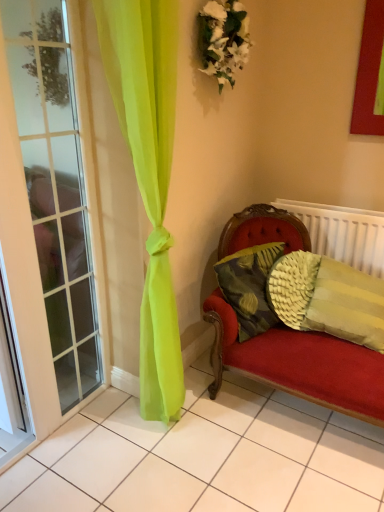
This screenshot has width=384, height=512. I want to click on white textured radiator at right, so click(342, 233).

Image resolution: width=384 pixels, height=512 pixels. Describe the element at coordinates (223, 39) in the screenshot. I see `white fabric floral arrangement at upper center` at that location.

The height and width of the screenshot is (512, 384). What do you see at coordinates (327, 298) in the screenshot? I see `textured yellow pillow at right, which ranks as the 2th pillow in left-to-right order` at bounding box center [327, 298].

Find the location of `textured yellow pillow at right, the first pillow from the left`. textured yellow pillow at right, the first pillow from the left is located at coordinates (249, 287).

Which pillow is the 1st one when counting from the front of the white textured radiator at right? Please provide its 2D coordinates.

[(249, 287)]

Which is more to the right, white textured radiator at right or textured yellow pillow at right, which is the second pillow from right to left?

white textured radiator at right.

Is white textured radiator at right facing towards textured yellow pillow at right, the first pillow from the left?

Yes, white textured radiator at right is oriented towards textured yellow pillow at right, the first pillow from the left.

Is the surface of white textured radiator at right in direct contact with clear glass door at left?

white textured radiator at right and clear glass door at left are not in contact.

Can you confirm if white textured radiator at right is thinner than clear glass door at left?

No, white textured radiator at right is not thinner than clear glass door at left.

Considering the sizes of objects white textured radiator at right and clear glass door at left in the image provided, who is smaller, white textured radiator at right or clear glass door at left?

white textured radiator at right.

Which is more to the right, white textured radiator at right or clear glass door at left?

white textured radiator at right is more to the right.

Considering the relative sizes of white fabric floral arrangement at upper center and textured yellow pillow at right, which ranks as the 2th pillow in left-to-right order, in the image provided, is white fabric floral arrangement at upper center wider than textured yellow pillow at right, which ranks as the 2th pillow in left-to-right order,?

In fact, white fabric floral arrangement at upper center might be narrower than textured yellow pillow at right, which ranks as the 2th pillow in left-to-right order.

From a real-world perspective, who is located lower, white fabric floral arrangement at upper center or textured yellow pillow at right, positioned as the first pillow in right-to-left order?

In real-world perspective, textured yellow pillow at right, positioned as the first pillow in right-to-left order, is lower.

Which object is positioned more to the right, white fabric floral arrangement at upper center or textured yellow pillow at right, which ranks as the 2th pillow in left-to-right order?

textured yellow pillow at right, which ranks as the 2th pillow in left-to-right order.

Measure the distance between white fabric floral arrangement at upper center and white textured radiator at right.

They are 1.01 meters apart.

Where is `floral arrangement in front of the white textured radiator at right`? This screenshot has width=384, height=512. floral arrangement in front of the white textured radiator at right is located at coordinates (223, 39).

Does point (213, 70) come farther from viewer compared to point (324, 218)?

No.

From the image's perspective, is white fabric floral arrangement at upper center above or below white textured radiator at right?

Based on their image positions, white fabric floral arrangement at upper center is located above white textured radiator at right.

From a real-world perspective, is textured yellow pillow at right, which ranks as the 2th pillow in left-to-right order, over white fabric floral arrangement at upper center?

No, from a real-world perspective, textured yellow pillow at right, which ranks as the 2th pillow in left-to-right order, is not above white fabric floral arrangement at upper center.

How many degrees apart are the facing directions of textured yellow pillow at right, positioned as the first pillow in right-to-left order, and white fabric floral arrangement at upper center?

There is a 94.2-degree angle between the facing directions of textured yellow pillow at right, positioned as the first pillow in right-to-left order, and white fabric floral arrangement at upper center.

Which is closer to the camera, (342, 337) or (248, 23)?

Positioned in front is point (342, 337).

Considering the sizes of objects textured yellow pillow at right, which ranks as the 2th pillow in left-to-right order, and white fabric floral arrangement at upper center in the image provided, who is wider, textured yellow pillow at right, which ranks as the 2th pillow in left-to-right order, or white fabric floral arrangement at upper center?

textured yellow pillow at right, which ranks as the 2th pillow in left-to-right order.

Is white textured radiator at right inside the boundaries of white fabric floral arrangement at upper center, or outside?

white textured radiator at right is not enclosed by white fabric floral arrangement at upper center.

From a real-world perspective, which object rests below the other?

From a 3D spatial view, white textured radiator at right is below.

Does white textured radiator at right turn towards white fabric floral arrangement at upper center?

No, white textured radiator at right does not turn towards white fabric floral arrangement at upper center.

Which is closer to the camera, (370, 340) or (257, 309)?

Point (370, 340) appears to be closer to the viewer than point (257, 309).

Does textured yellow pillow at right, which ranks as the 2th pillow in left-to-right order, come behind textured yellow pillow at right, which is the second pillow from right to left?

No, textured yellow pillow at right, which ranks as the 2th pillow in left-to-right order, is closer to the camera.

Looking at their sizes, would you say textured yellow pillow at right, which ranks as the 2th pillow in left-to-right order, is wider or thinner than textured yellow pillow at right, which is the second pillow from right to left?

In the image, textured yellow pillow at right, which ranks as the 2th pillow in left-to-right order, appears to be wider than textured yellow pillow at right, which is the second pillow from right to left.

From a real-world perspective, is textured yellow pillow at right, positioned as the first pillow in right-to-left order, over textured yellow pillow at right, which is the second pillow from right to left?

No, from a real-world perspective, textured yellow pillow at right, positioned as the first pillow in right-to-left order, is not over textured yellow pillow at right, which is the second pillow from right to left

Locate an element on the screen. The height and width of the screenshot is (512, 384). radiator above the textured yellow pillow at right, the first pillow from the left (from a real-world perspective) is located at coordinates (342, 233).

This screenshot has width=384, height=512. What are the coordinates of `window in front of the white textured radiator at right` in the screenshot? It's located at (51, 211).

When comparing their distances from clear glass door at left, does textured yellow pillow at right, the first pillow from the left, or white fabric floral arrangement at upper center seem further?

white fabric floral arrangement at upper center lies further to clear glass door at left than the other object.

Based on their spatial positions, is textured yellow pillow at right, the first pillow from the left, or clear glass door at left closer to white textured radiator at right?

Based on the image, textured yellow pillow at right, the first pillow from the left, appears to be nearer to white textured radiator at right.

When comparing their distances from white fabric floral arrangement at upper center, does textured yellow pillow at right, which is the second pillow from right to left, or white textured radiator at right seem closer?

textured yellow pillow at right, which is the second pillow from right to left, lies closer to white fabric floral arrangement at upper center than the other object.

Which object lies further to the anchor point textured yellow pillow at right, which is the second pillow from right to left, clear glass door at left or textured yellow pillow at right, positioned as the first pillow in right-to-left order?

clear glass door at left.

When comparing their distances from white fabric floral arrangement at upper center, does clear glass door at left or white textured radiator at right seem closer?

Based on the image, clear glass door at left appears to be nearer to white fabric floral arrangement at upper center.

Considering their positions, is clear glass door at left positioned further to textured yellow pillow at right, positioned as the first pillow in right-to-left order, than textured yellow pillow at right, which is the second pillow from right to left?

The object further to textured yellow pillow at right, positioned as the first pillow in right-to-left order, is clear glass door at left.

Looking at the image, which one is located further to white fabric floral arrangement at upper center, textured yellow pillow at right, which ranks as the 2th pillow in left-to-right order, or textured yellow pillow at right, the first pillow from the left?

textured yellow pillow at right, which ranks as the 2th pillow in left-to-right order, lies further to white fabric floral arrangement at upper center than the other object.

Considering their positions, is textured yellow pillow at right, positioned as the first pillow in right-to-left order, positioned further to textured yellow pillow at right, the first pillow from the left, than clear glass door at left?

clear glass door at left is further to textured yellow pillow at right, the first pillow from the left.

The height and width of the screenshot is (512, 384). What are the coordinates of `radiator between white fabric floral arrangement at upper center and textured yellow pillow at right, which ranks as the 2th pillow in left-to-right order, from top to bottom` in the screenshot? It's located at (342, 233).

The height and width of the screenshot is (512, 384). What are the coordinates of `pillow between clear glass door at left and textured yellow pillow at right, positioned as the first pillow in right-to-left order, from left to right` in the screenshot? It's located at (249, 287).

Identify the location of pillow between white fabric floral arrangement at upper center and textured yellow pillow at right, positioned as the first pillow in right-to-left order, from top to bottom. (249, 287).

In order to click on pillow situated between textured yellow pillow at right, the first pillow from the left, and white textured radiator at right from left to right in this screenshot , I will do `click(327, 298)`.